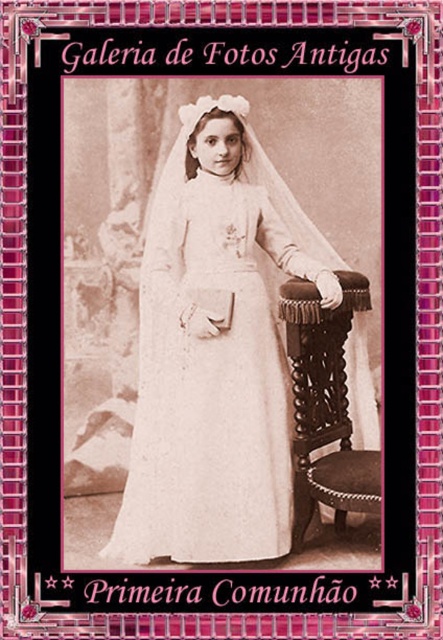
Based on the scene described, where is the white lace dress at center positioned relative to the brown wood stool at right?

The white lace dress at center is positioned to the left of the brown wood stool at right.